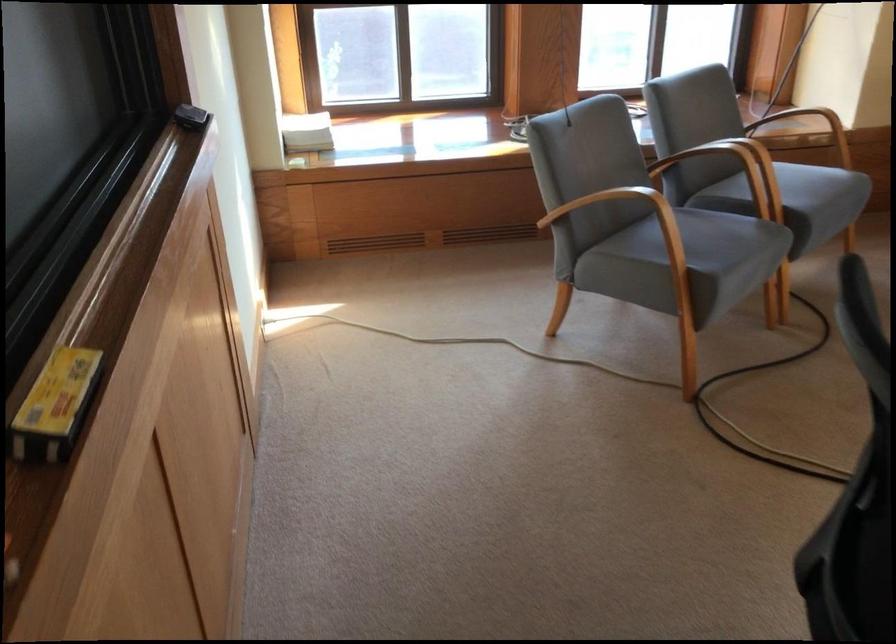
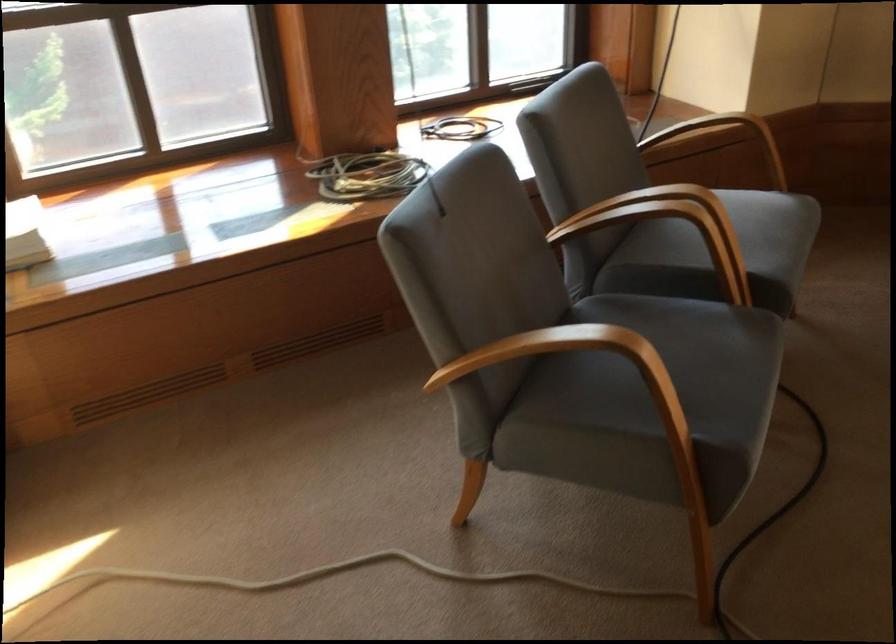
Find the pixel in the second image that matches [675,242] in the first image.

(650, 398)